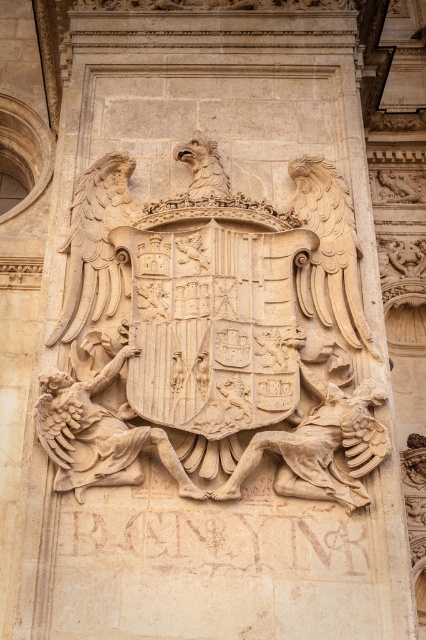
Question: Estimate the real-world distances between objects in this image. Which object is farther from the beige stone figure at center?

Choices:
 (A) beige stone warrior at center
 (B) carved stone coat of arms at center

Answer: (B)

Question: Estimate the real-world distances between objects in this image. Which object is farther from the beige stone figure at center?

Choices:
 (A) beige stone warrior at center
 (B) carved stone coat of arms at center

Answer: (B)

Question: Can you confirm if carved stone coat of arms at center is thinner than beige stone warrior at center?

Choices:
 (A) no
 (B) yes

Answer: (A)

Question: Does carved stone coat of arms at center lie behind beige stone warrior at center?

Choices:
 (A) yes
 (B) no

Answer: (B)

Question: Which point is farther from the camera taking this photo?

Choices:
 (A) (356, 472)
 (B) (281, 410)
 (C) (115, 442)

Answer: (B)

Question: From the image, what is the correct spatial relationship of beige stone warrior at center in relation to beige stone figure at center?

Choices:
 (A) right
 (B) left

Answer: (B)